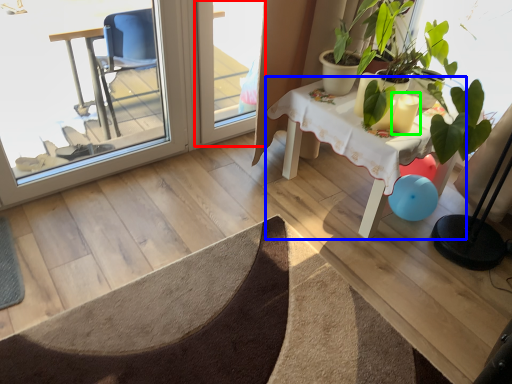
Question: Which is farther away from screen door (highlighted by a red box)? table (highlighted by a blue box) or candle holder (highlighted by a green box)?

Choices:
 (A) table
 (B) candle holder

Answer: (B)